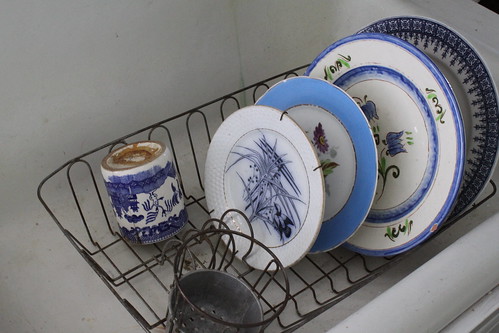
Find the location of a particular element. This screenshot has height=333, width=499. plates is located at coordinates (259, 203), (337, 161), (398, 127), (463, 94).